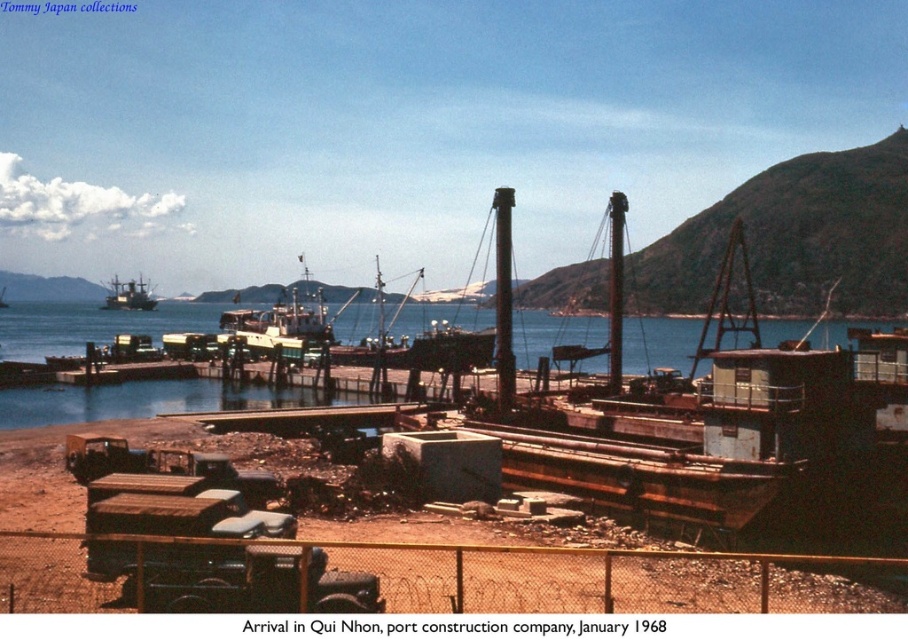
Can you confirm if rusty metal barge at center is bigger than smooth blue water at center?

Actually, rusty metal barge at center might be smaller than smooth blue water at center.

In the scene shown: Does rusty metal barge at center appear on the left side of smooth blue water at center?

No, rusty metal barge at center is not to the left of smooth blue water at center.

The height and width of the screenshot is (640, 908). Find the location of `rusty metal barge at center`. rusty metal barge at center is located at coordinates (673, 412).

Identify the location of rusty metal barge at center. (673, 412).

Can you confirm if rusty metal barge at center is positioned below brushed metal boat at upper left?

Indeed, rusty metal barge at center is positioned under brushed metal boat at upper left.

Between rusty metal barge at center and brushed metal boat at upper left, which one has more height?

Standing taller between the two is brushed metal boat at upper left.

Where is `rusty metal barge at center`? Image resolution: width=908 pixels, height=640 pixels. rusty metal barge at center is located at coordinates (673, 412).

Which is below, smooth blue water at center or brushed metal boat at upper left?

smooth blue water at center is lower down.

Is smooth blue water at center bigger than brushed metal boat at upper left?

Correct, smooth blue water at center is larger in size than brushed metal boat at upper left.

The width and height of the screenshot is (908, 640). Identify the location of smooth blue water at center. (147, 401).